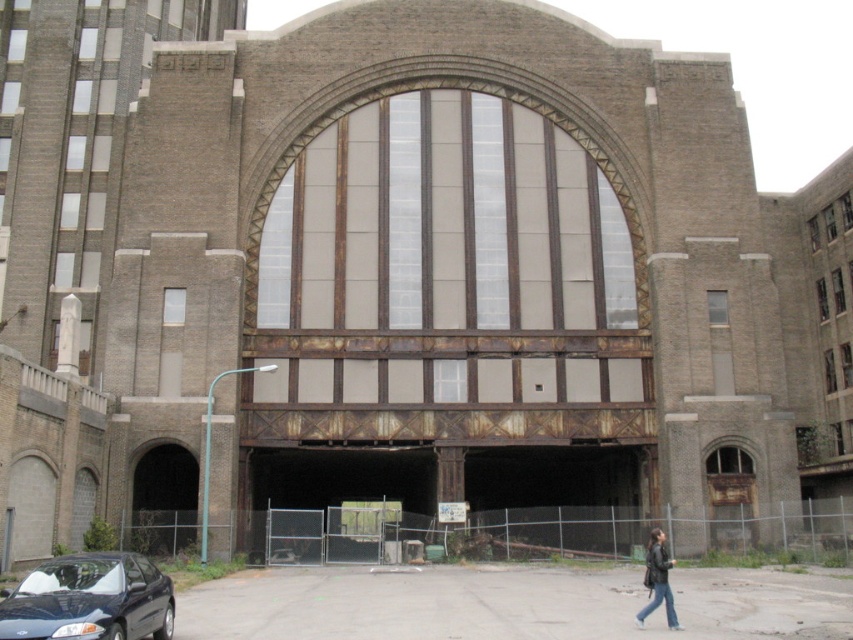
You are a photographer standing in front of the historic building. You want to take a photo that includes both the shiny black sedan at lower left and the black leather jacket at lower right. Considering their sizes, which object should you focus on to ensure both are clearly visible in the frame?

Since the shiny black sedan at lower left is larger than the black leather jacket at lower right, you should focus on the shiny black sedan at lower left to ensure both objects are clearly visible in the frame.

Looking at this image, you are a delivery person needing to park your 2.5 meter wide van. You see the shiny black sedan at lower left and the black leather jacket at lower right in the parking area. Can your van fit in the space between them?

The shiny black sedan at lower left is wider than the black leather jacket at lower right. Since the space between them is determined by the width of the sedan, which is wider, there should be enough space for your 2.5 meter wide van to fit between them.